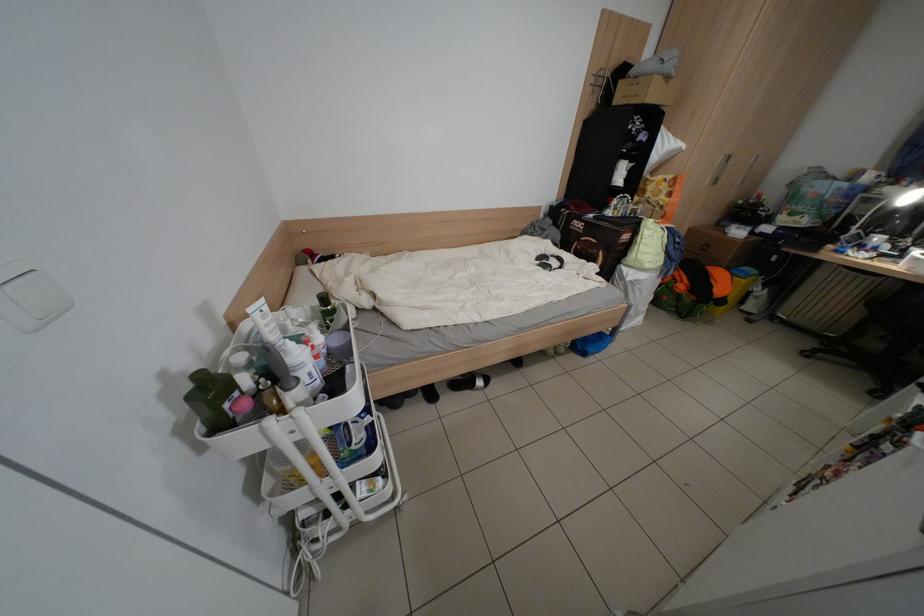
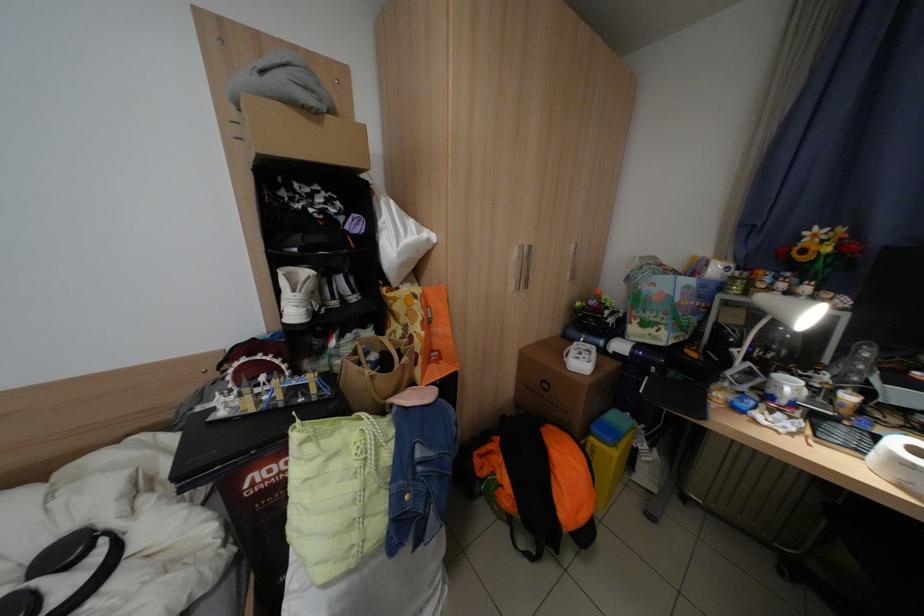
In the second image, find the point that corresponds to [891,240] in the first image.

(800, 387)